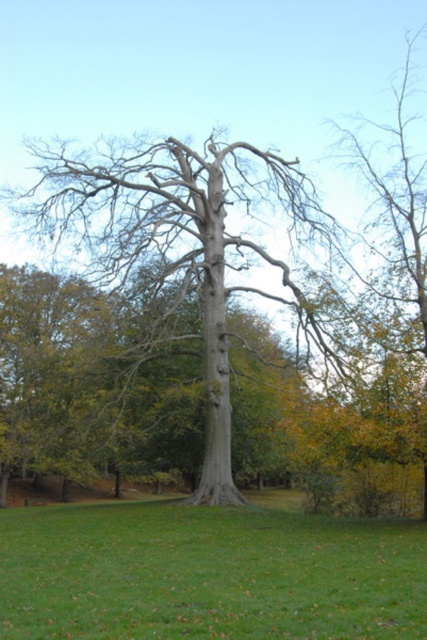
Is green grass at center to the left of gray bark tree at center from the viewer's perspective?

In fact, green grass at center is to the right of gray bark tree at center.

Measure the distance between green grass at center and camera.

green grass at center and camera are 5.72 meters apart from each other.

Does point (330, 611) lie behind point (23, 195)?

That is False.

At what (x,y) coordinates should I click in order to perform the action: click on green grass at center. Please return your answer as a coordinate pair (x, y). Looking at the image, I should click on (207, 573).